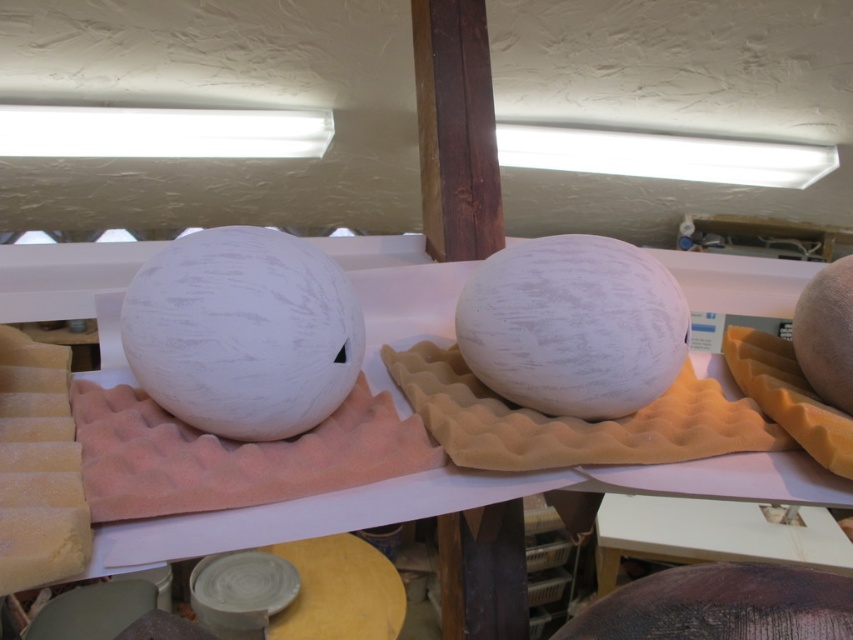
Question: Is white matte sphere at center above white matte melon at center?

Choices:
 (A) yes
 (B) no

Answer: (B)

Question: Does white matte sphere at center come in front of smooth beige melon at right?

Choices:
 (A) yes
 (B) no

Answer: (A)

Question: Among these objects, which one is farthest from the camera?

Choices:
 (A) white matte sphere at center
 (B) smooth beige melon at right
 (C) white textured melon at left
 (D) white matte melon at center

Answer: (B)

Question: Which point appears farthest from the camera in this image?

Choices:
 (A) (840, 328)
 (B) (154, 273)

Answer: (A)

Question: Estimate the real-world distances between objects in this image. Which object is farther from the white textured melon at left?

Choices:
 (A) white matte melon at center
 (B) smooth beige melon at right

Answer: (B)

Question: Is white matte sphere at center positioned before smooth beige melon at right?

Choices:
 (A) yes
 (B) no

Answer: (A)